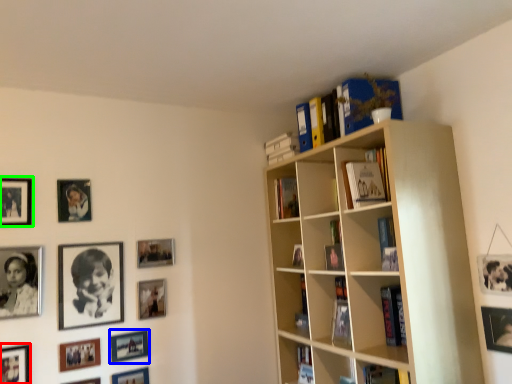
Question: Which is nearer to the picture frame (highlighted by a red box)? picture frame (highlighted by a blue box) or picture frame (highlighted by a green box).

Choices:
 (A) picture frame
 (B) picture frame

Answer: (A)